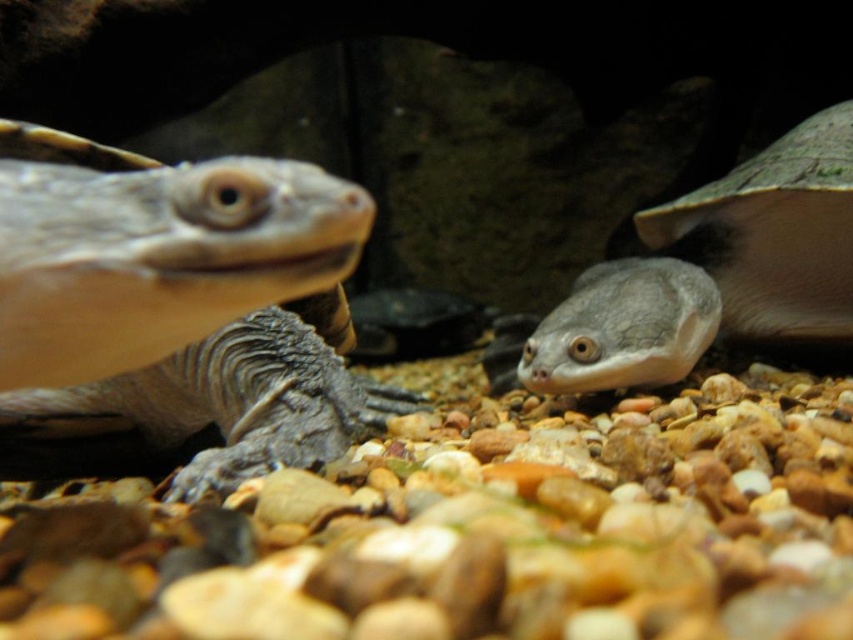
Which is below, smooth brown tortoise at left or matte gray tortoise at right?

smooth brown tortoise at left is below.

Looking at this image, can you confirm if smooth brown tortoise at left is wider than matte gray tortoise at right?

No, smooth brown tortoise at left is not wider than matte gray tortoise at right.

Does point (296, 264) come behind point (613, 326)?

No, it is not.

Locate an element on the screen. smooth brown tortoise at left is located at coordinates (152, 252).

Between smooth brown tortoise at left and smooth gray tortoise at center, which one has more height?

smooth gray tortoise at center

Can you confirm if smooth brown tortoise at left is shorter than smooth gray tortoise at center?

Yes, smooth brown tortoise at left is shorter than smooth gray tortoise at center.

Where is `smooth brown tortoise at left`? The width and height of the screenshot is (853, 640). smooth brown tortoise at left is located at coordinates (152, 252).

Can you confirm if matte gray tortoise at right is positioned below smooth gray tortoise at center?

Incorrect, matte gray tortoise at right is not positioned below smooth gray tortoise at center.

Who is more forward, [808,166] or [199,353]?

Point [199,353]

What do you see at coordinates (714, 272) in the screenshot? This screenshot has height=640, width=853. I see `matte gray tortoise at right` at bounding box center [714, 272].

Where is `matte gray tortoise at right`? matte gray tortoise at right is located at coordinates tap(714, 272).